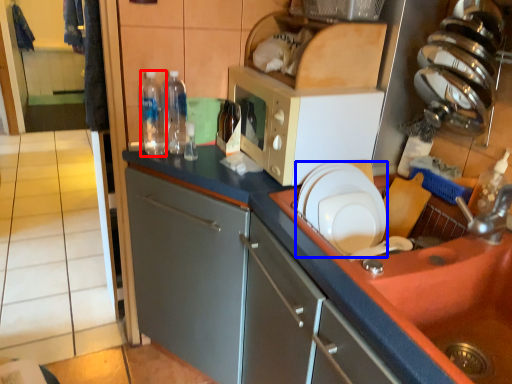
Question: Which object is closer to the camera taking this photo, bottle (highlighted by a red box) or plate (highlighted by a blue box)?

Choices:
 (A) bottle
 (B) plate

Answer: (B)